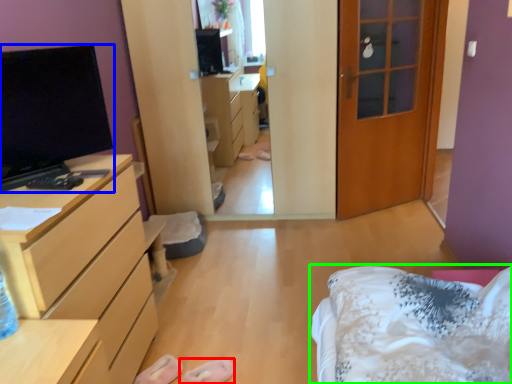
Question: Based on their relative distances, which object is farther from shoe (highlighted by a red box)? Choose from television (highlighted by a blue box) and bed (highlighted by a green box).

Choices:
 (A) television
 (B) bed

Answer: (A)